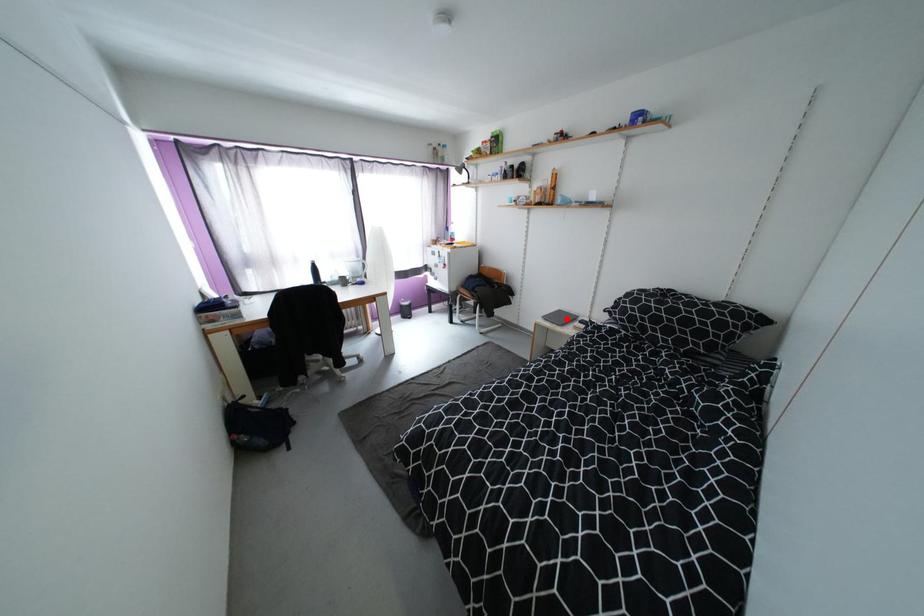
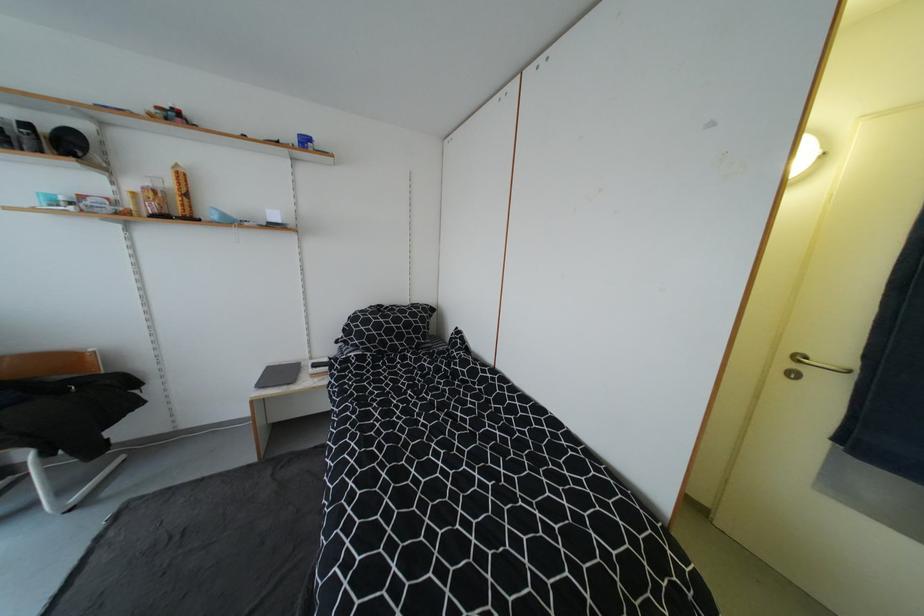
Where in the second image is the point corresponding to the highlighted location from the first image?

(286, 376)